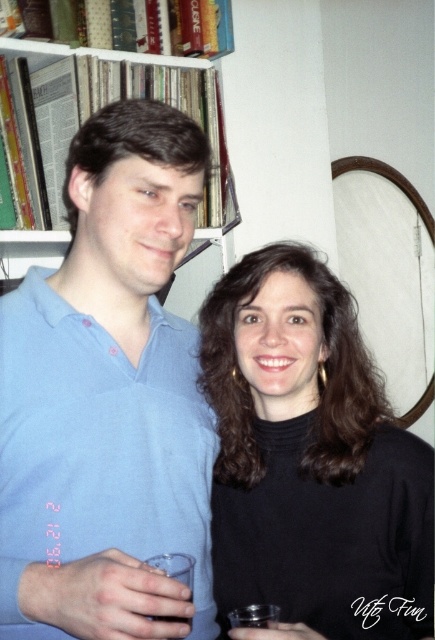
Question: Can you confirm if light blue cotton shirt at center is positioned to the left of black matte turtleneck at center?

Choices:
 (A) no
 (B) yes

Answer: (B)

Question: Which point is closer to the camera?

Choices:
 (A) [x=271, y=614]
 (B) [x=153, y=564]
 (C) [x=50, y=136]

Answer: (A)

Question: Which object appears closest to the camera in this image?

Choices:
 (A) clear plastic cup at lower left
 (B) black matte turtleneck at center

Answer: (A)

Question: Is black matte turtleneck at center bigger than wooden bookshelf at upper left?

Choices:
 (A) yes
 (B) no

Answer: (B)

Question: In this image, where is wooden bookshelf at upper left located relative to clear plastic cup at lower left?

Choices:
 (A) right
 (B) left

Answer: (B)

Question: Which point is closer to the camera?

Choices:
 (A) (203, 124)
 (B) (178, 564)
 (C) (321, 477)
 (D) (139, 221)

Answer: (B)